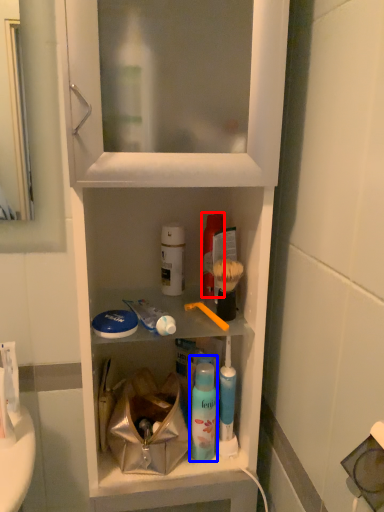
Question: Which point is closer to the camera, mouthwash (highlighted by a red box) or mouthwash (highlighted by a blue box)?

Choices:
 (A) mouthwash
 (B) mouthwash

Answer: (B)